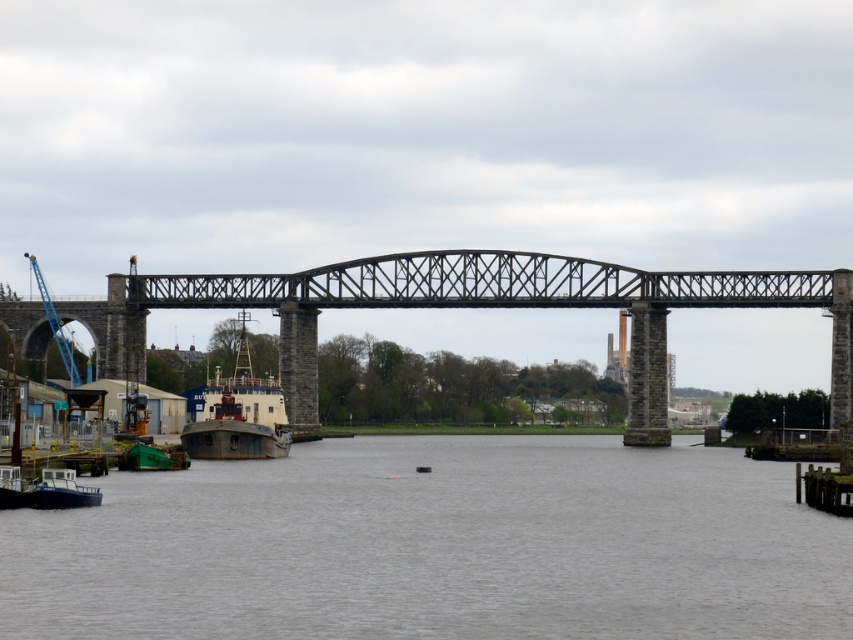
Question: Is the position of metallic gray bridge at center less distant than that of wooden dock at lower right?

Choices:
 (A) yes
 (B) no

Answer: (B)

Question: Is gray concrete water at center thinner than blue matte tugboat at lower left?

Choices:
 (A) yes
 (B) no

Answer: (B)

Question: Does metallic gray bridge at center appear on the left side of wooden dock at lower right?

Choices:
 (A) no
 (B) yes

Answer: (B)

Question: Which is farther from the wooden dock at lower right?

Choices:
 (A) blue matte boat at lower left
 (B) gray concrete water at center
 (C) blue metallic crane at left
 (D) blue matte tugboat at lower left

Answer: (C)

Question: Which of the following is the closest to the observer?

Choices:
 (A) gray concrete water at center
 (B) blue metallic crane at left

Answer: (A)

Question: Which point is closer to the camera taking this photo?

Choices:
 (A) (846, 349)
 (B) (573, 630)
 (C) (38, 268)
 (D) (56, 486)

Answer: (B)